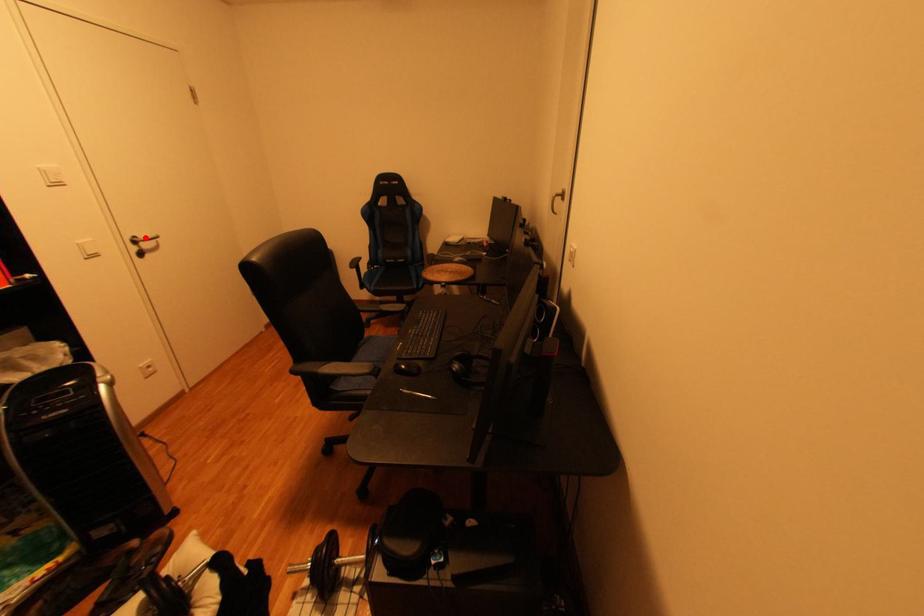
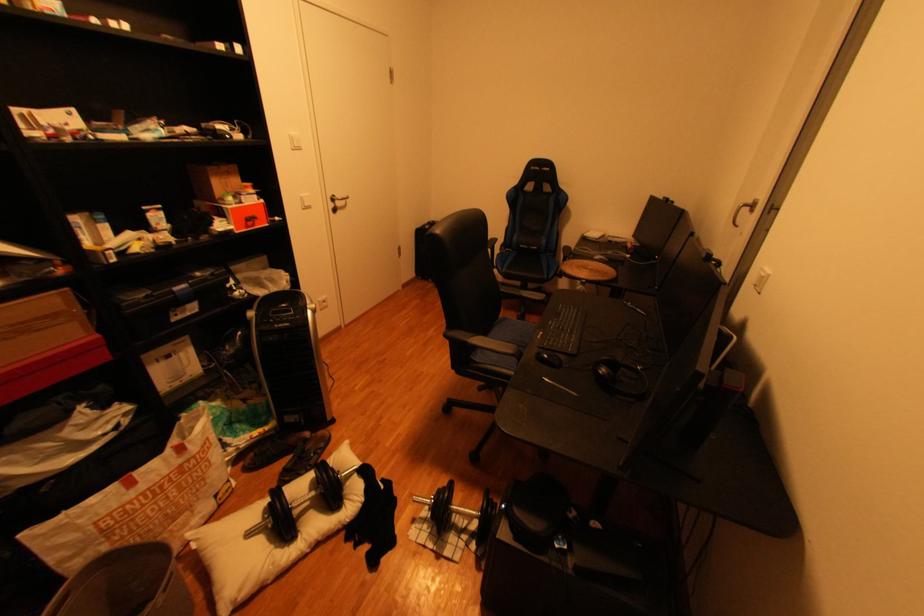
The point at the highlighted location is marked in the first image. Where is the corresponding point in the second image?

(345, 197)